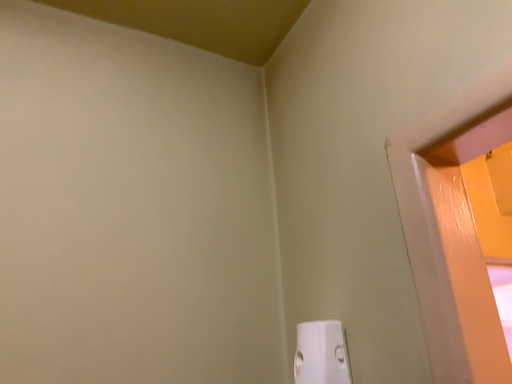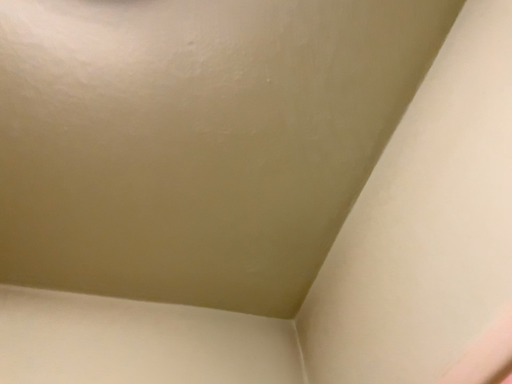
Question: How did the camera likely rotate when shooting the video?

Choices:
 (A) rotated downward
 (B) rotated upward

Answer: (B)